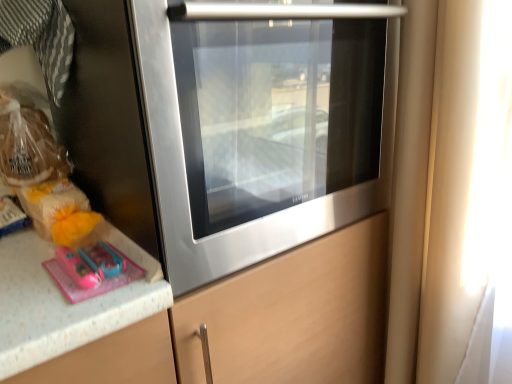
Question: In terms of height, does transparent glass window at right look taller or shorter compared to stainless steel oven at center?

Choices:
 (A) short
 (B) tall

Answer: (B)

Question: In the image, is transparent glass window at right positioned in front of or behind stainless steel oven at center?

Choices:
 (A) behind
 (B) front

Answer: (A)

Question: Considering the real-world distances, which object is closest to the translucent plastic bag at left, which ranks as the 2th food in top-to-bottom order?

Choices:
 (A) translucent plastic bread at left, marked as the first food in a top-to-bottom arrangement
 (B) transparent glass window at right
 (C) stainless steel oven at center

Answer: (A)

Question: Considering the real-world distances, which object is farthest from the translucent plastic bread at left, the second food in the bottom-to-top sequence?

Choices:
 (A) transparent glass window at right
 (B) stainless steel oven at center
 (C) translucent plastic bag at left, which ranks as the 2th food in top-to-bottom order

Answer: (A)